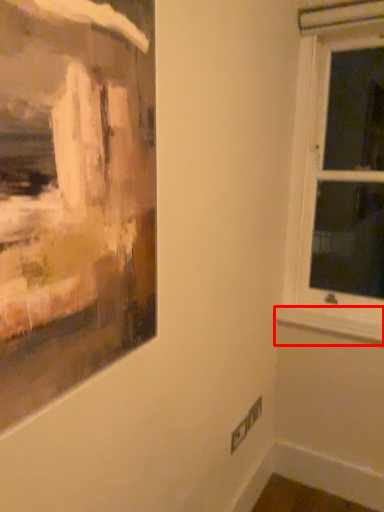
Question: Considering the relative positions of window sill (annotated by the red box) and window in the image provided, where is window sill (annotated by the red box) located with respect to the staircase?

Choices:
 (A) left
 (B) right

Answer: (A)